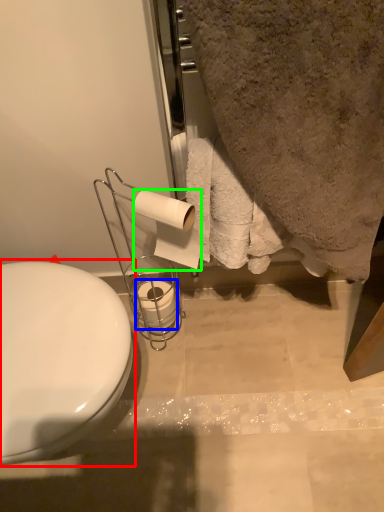
Question: Based on their relative distances, which object is farther from toilet (highlighted by a red box)? Choose from toilet paper (highlighted by a blue box) and toilet paper (highlighted by a green box).

Choices:
 (A) toilet paper
 (B) toilet paper

Answer: (A)